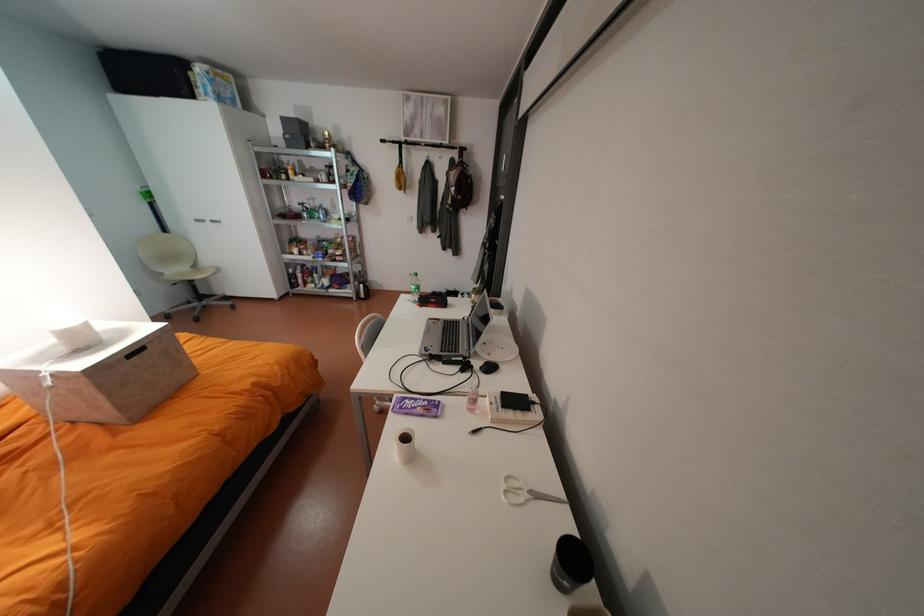
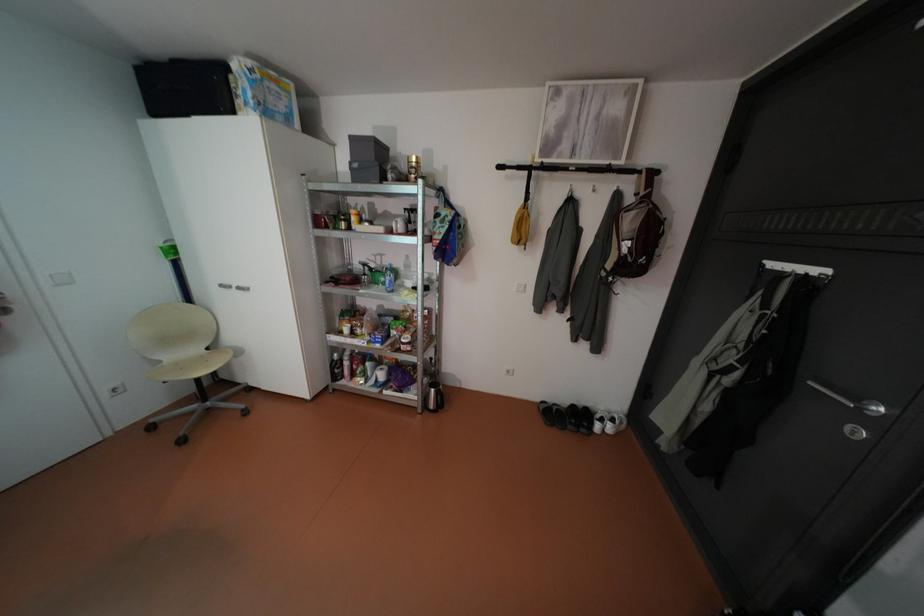
Where in the second image is the point corresponding to the point at 172,273 from the first image?

(168, 361)